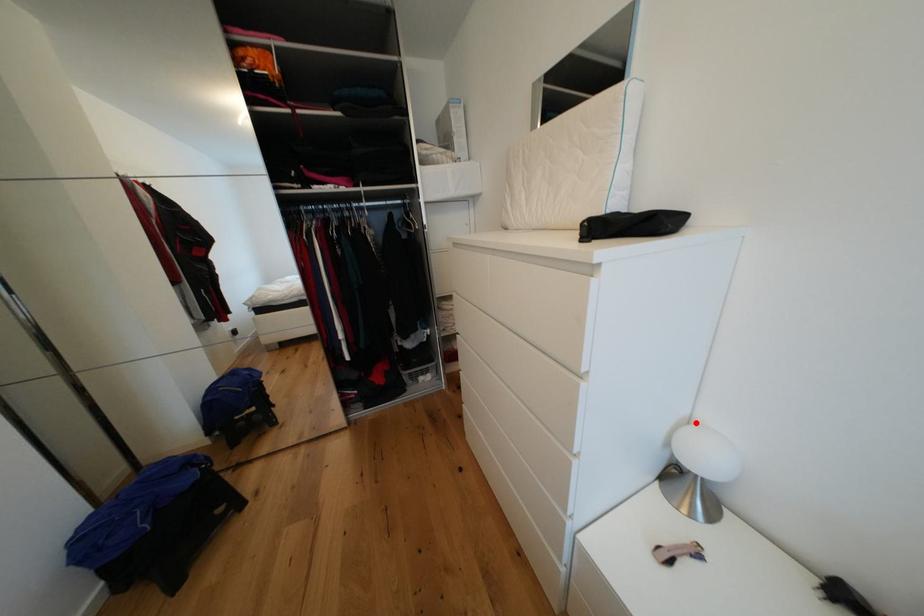
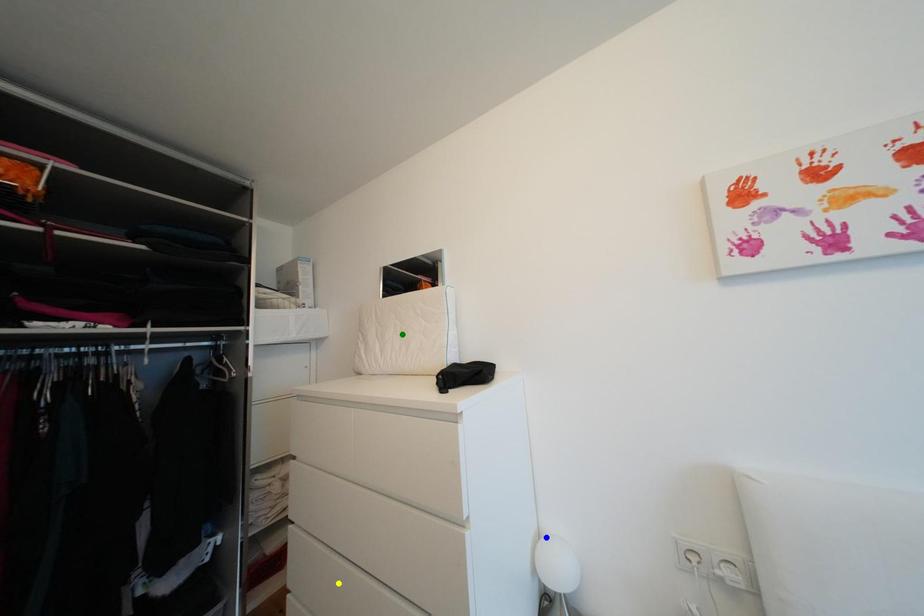
Question: I am providing you with two images of the same scene from different viewpoints. A red point is marked on the first image. You are given multiple points on the second image. Which mark in image 2 goes with the point in image 1?

Choices:
 (A) green point
 (B) yellow point
 (C) blue point

Answer: (C)